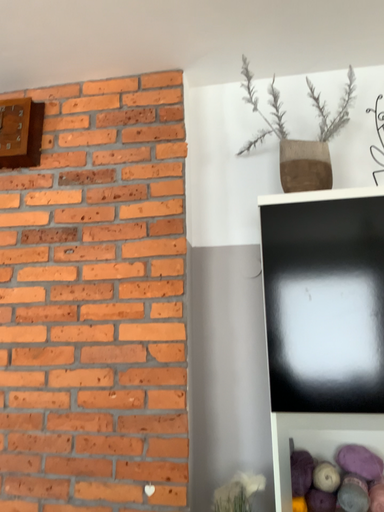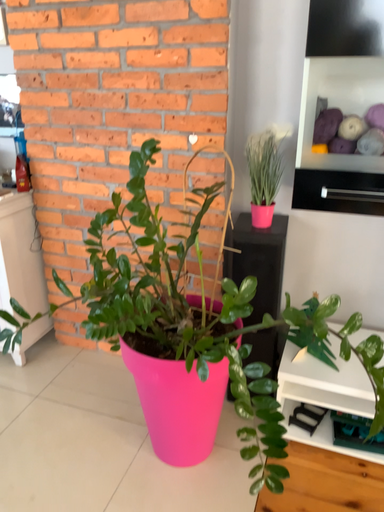
Question: Which way did the camera rotate in the video?

Choices:
 (A) rotated left
 (B) rotated right

Answer: (A)